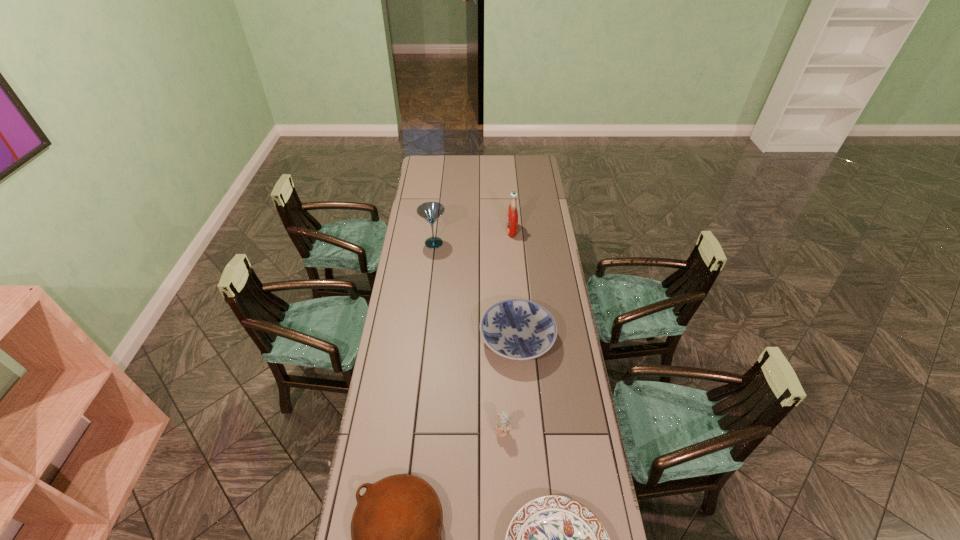
In order to click on vacant space situated on the front-facing side of the third tallest object in this screenshot , I will do `click(506, 494)`.

Locate an element on the screen. The width and height of the screenshot is (960, 540). vacant space positioned on the back of the tallest plate is located at coordinates (511, 249).

I want to click on object present at the left edge, so click(430, 211).

The height and width of the screenshot is (540, 960). I want to click on object at the right edge, so click(x=517, y=329).

The height and width of the screenshot is (540, 960). In the image, there is a desktop. What are the coordinates of `vacant space at the far edge` in the screenshot? It's located at (457, 176).

Image resolution: width=960 pixels, height=540 pixels. I want to click on blank space at the left edge of the desktop, so click(x=425, y=286).

Find the location of a particular element. The height and width of the screenshot is (540, 960). vacant space at the right edge is located at coordinates (569, 400).

In order to click on blank area at the far left corner in this screenshot , I will do `click(440, 158)`.

Image resolution: width=960 pixels, height=540 pixels. In order to click on vacant space at the far right corner of the desktop in this screenshot , I will do `click(530, 158)`.

Find the location of a particular element. The width and height of the screenshot is (960, 540). vacant point located between the martini and the fourth farthest object is located at coordinates (468, 337).